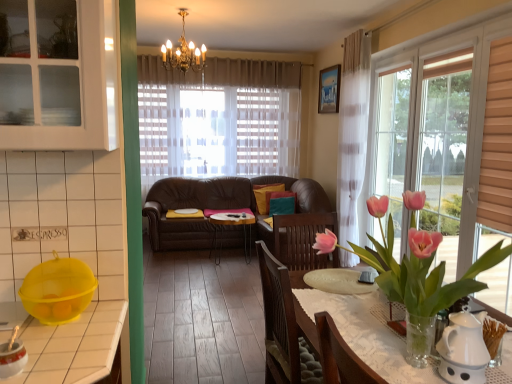
This screenshot has width=512, height=384. What are the coordinates of `white glass cabinet at upper left` in the screenshot? It's located at (58, 75).

What do you see at coordinates (58, 75) in the screenshot? The height and width of the screenshot is (384, 512). I see `white glass cabinet at upper left` at bounding box center [58, 75].

Measure the distance between point (99,6) and camera.

1.27 meters.

Where is `transparent glass window at right`? This screenshot has width=512, height=384. transparent glass window at right is located at coordinates (444, 146).

Measure the distance between transparent glass window at right and camera.

transparent glass window at right and camera are 10.28 feet apart from each other.

This screenshot has height=384, width=512. What do you see at coordinates (444, 146) in the screenshot?
I see `transparent glass window at right` at bounding box center [444, 146].

At what (x,y) coordinates should I click in order to perform the action: click on white glass cabinet at upper left. Please return your answer as a coordinate pair (x, y). This screenshot has width=512, height=384. Looking at the image, I should click on (58, 75).

Can you confirm if white glass cabinet at upper left is positioned to the left of transparent glass window at right?

Yes.

In the scene shown: Is white glass cabinet at upper left further to the viewer compared to transparent glass window at right?

No.

Is point (65, 101) less distant than point (462, 214)?

Yes, it is in front of point (462, 214).

From the image's perspective, is white glass cabinet at upper left on top of transparent glass window at right?

Indeed, from the image's perspective, white glass cabinet at upper left is shown above transparent glass window at right.

From a real-world perspective, between white glass cabinet at upper left and transparent glass window at right, who is vertically lower?

transparent glass window at right.

Is white glass cabinet at upper left thinner than transparent glass window at right?

Indeed, white glass cabinet at upper left has a lesser width compared to transparent glass window at right.

From the picture: Is white glass cabinet at upper left taller than transparent glass window at right?

No.

Which of these two, white glass cabinet at upper left or transparent glass window at right, is bigger?

Bigger between the two is transparent glass window at right.

Could transparent glass window at right be considered to be inside white glass cabinet at upper left?

No, transparent glass window at right is located outside of white glass cabinet at upper left.

Would you consider white glass cabinet at upper left to be distant from transparent glass window at right?

white glass cabinet at upper left is far away from transparent glass window at right.

Is white glass cabinet at upper left positioned with its back to transparent glass window at right?

No, transparent glass window at right is not at the back of white glass cabinet at upper left.

Looking at this image, how many degrees apart are the facing directions of white glass cabinet at upper left and transparent glass window at right?

white glass cabinet at upper left and transparent glass window at right are facing 1.06 degrees away from each other.

This screenshot has height=384, width=512. In order to click on window to the right of white glass cabinet at upper left in this screenshot , I will do `click(444, 146)`.

In the image, is transparent glass window at right on the left side or the right side of white glass cabinet at upper left?

Based on their positions, transparent glass window at right is located to the right of white glass cabinet at upper left.

In the image, is transparent glass window at right positioned in front of or behind white glass cabinet at upper left?

Clearly, transparent glass window at right is behind white glass cabinet at upper left.

In the scene shown: Which is less distant, (450, 239) or (18, 126)?

The point (18, 126) is more forward.

From the image's perspective, is transparent glass window at right over white glass cabinet at upper left?

No, from the image's perspective, transparent glass window at right is not on top of white glass cabinet at upper left.

From a real-world perspective, between transparent glass window at right and white glass cabinet at upper left, who is vertically higher?

white glass cabinet at upper left is physically above.

Considering the sizes of objects transparent glass window at right and white glass cabinet at upper left in the image provided, who is wider, transparent glass window at right or white glass cabinet at upper left?

With larger width is transparent glass window at right.

Between transparent glass window at right and white glass cabinet at upper left, which one has more height?

transparent glass window at right.

Between transparent glass window at right and white glass cabinet at upper left, which one has larger size?

With larger size is transparent glass window at right.

Is transparent glass window at right spatially inside white glass cabinet at upper left, or outside of it?

transparent glass window at right cannot be found inside white glass cabinet at upper left.

Are transparent glass window at right and white glass cabinet at upper left beside each other?

No, transparent glass window at right is not touching white glass cabinet at upper left.

Is transparent glass window at right looking in the opposite direction of white glass cabinet at upper left?

No, transparent glass window at right's orientation is not away from white glass cabinet at upper left.

Can you tell me how much transparent glass window at right and white glass cabinet at upper left differ in facing direction?

transparent glass window at right and white glass cabinet at upper left are facing 1.06 degrees away from each other.

You are a GUI agent. You are given a task and a screenshot of the screen. Output one action in this format:
    pyautogui.click(x=<x>, y=<y>)
    Task: Click on the cabinetry in front of the transparent glass window at right
    The image size is (512, 384).
    Given the screenshot: What is the action you would take?
    pyautogui.click(x=58, y=75)

The image size is (512, 384). I want to click on cabinetry above the transparent glass window at right (from the image's perspective), so click(x=58, y=75).

Where is `window that is behind the white glass cabinet at upper left`? Image resolution: width=512 pixels, height=384 pixels. window that is behind the white glass cabinet at upper left is located at coordinates (444, 146).